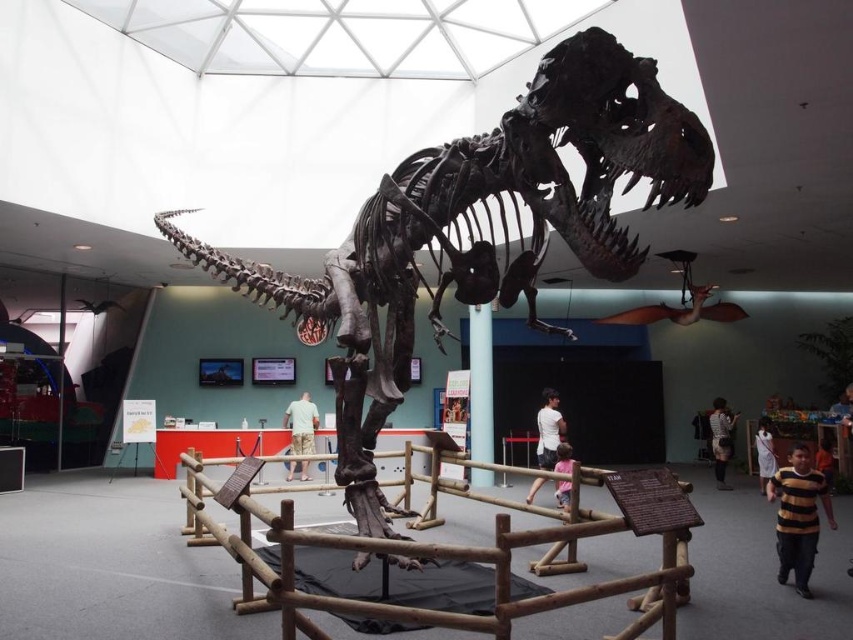
Question: Which object appears farthest from the camera in this image?

Choices:
 (A) white cotton dress at lower right
 (B) yellow striped sweater at lower right
 (C) light green fabric shorts at center
 (D) blue glossy pillar at center

Answer: (C)

Question: Can you confirm if blue glossy pillar at center is positioned to the right of dark brown shirt at center?

Choices:
 (A) no
 (B) yes

Answer: (A)

Question: Can you confirm if yellow striped sweater at lower right is smaller than dark brown shirt at center?

Choices:
 (A) yes
 (B) no

Answer: (A)

Question: Estimate the real-world distances between objects in this image. Which object is closer to the dark brown shirt at center?

Choices:
 (A) shiny metallic skeleton at center
 (B) striped shirt at lower right

Answer: (B)

Question: Which of the following is the closest to the observer?

Choices:
 (A) dark brown shirt at center
 (B) white cotton dress at lower right
 (C) yellow striped sweater at lower right

Answer: (C)

Question: Where is striped shirt at lower right located in relation to pink fabric dress at center in the image?

Choices:
 (A) left
 (B) right

Answer: (B)